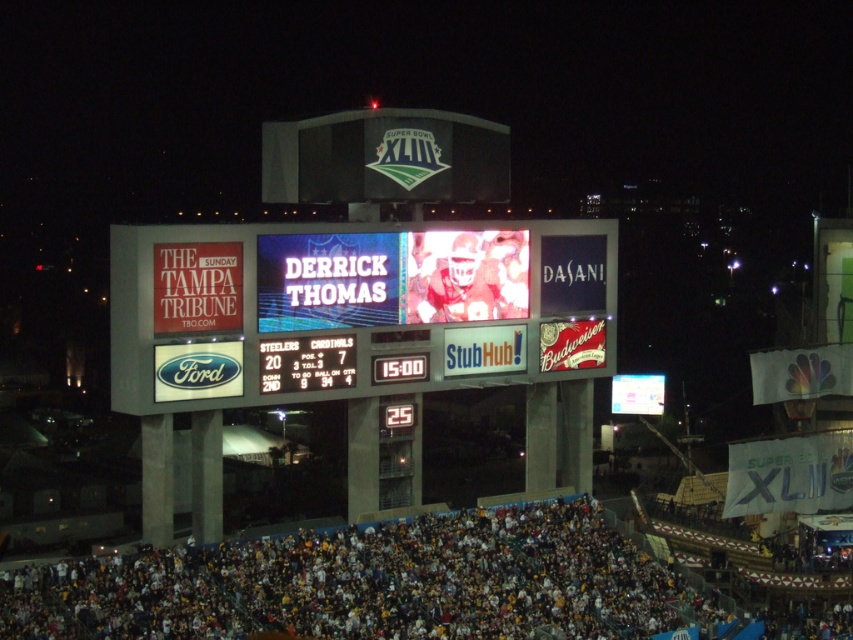
You are a photographer trying to capture the entire scene of the Super Bowl XLIII stadium. You notice the LED digital display at center and the multicolored fabric crowd at lower center. Which object should you focus on first to ensure both are in frame?

The multicolored fabric crowd at lower center has a greater width than the LED digital display at center, so focusing on the wider multicolored fabric crowd at lower center first will help ensure both fit within the frame.

You are a drone operator trying to capture aerial footage of the stadium. You have two points marked on your map for camera positioning. The first point is at coordinates point (531, 330), and the second is at point (236, 580). Which point is closer to the front of the stadium?

Point (236, 580) is closer to the front of the stadium because it is in front of point (531, 330), which is behind it.